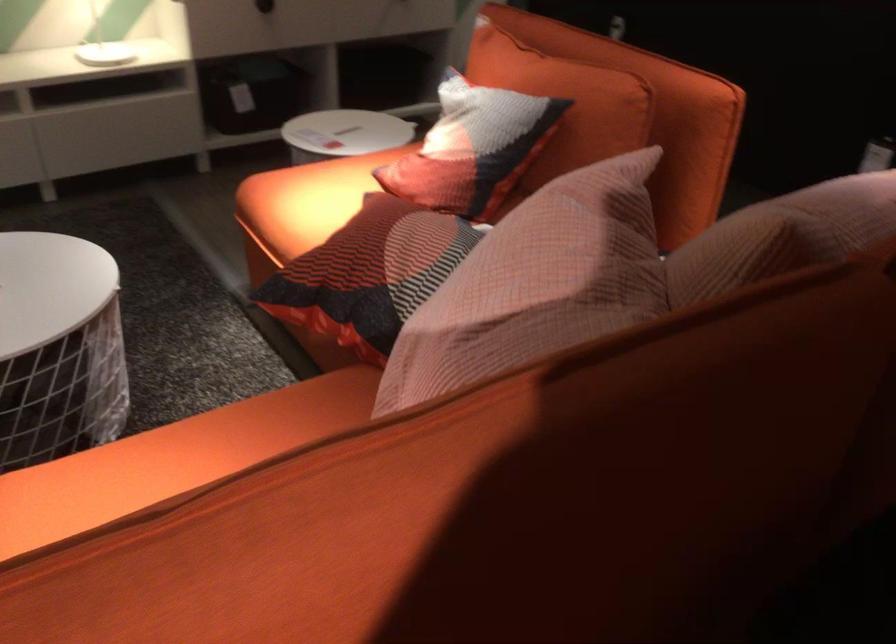
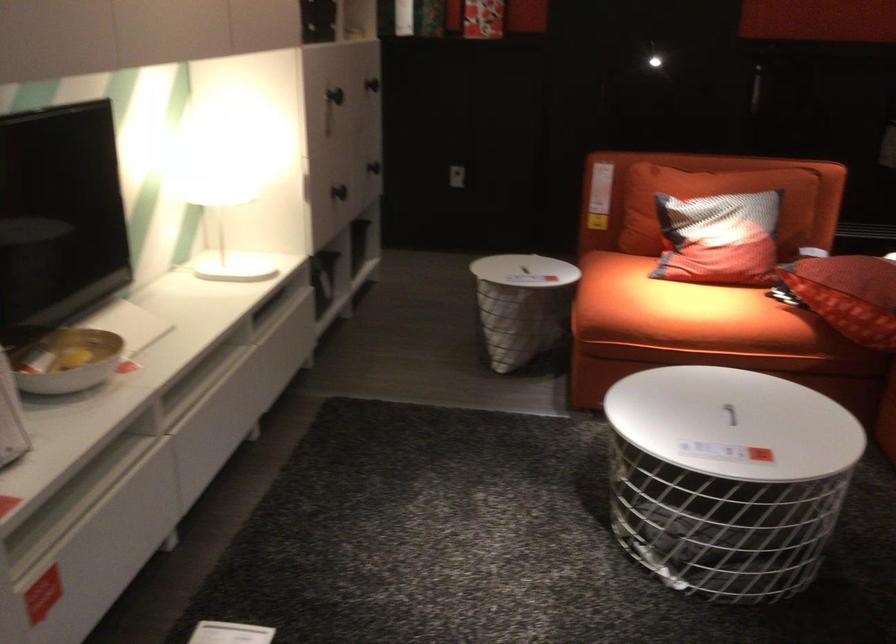
Where in the second image is the point corresponding to pixel 350 128 from the first image?

(522, 270)